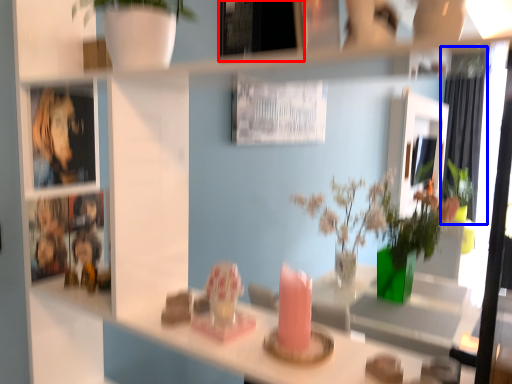
Question: Which object appears closest to the camera in this image, picture frame (highlighted by a red box) or curtain (highlighted by a blue box)?

Choices:
 (A) picture frame
 (B) curtain

Answer: (A)